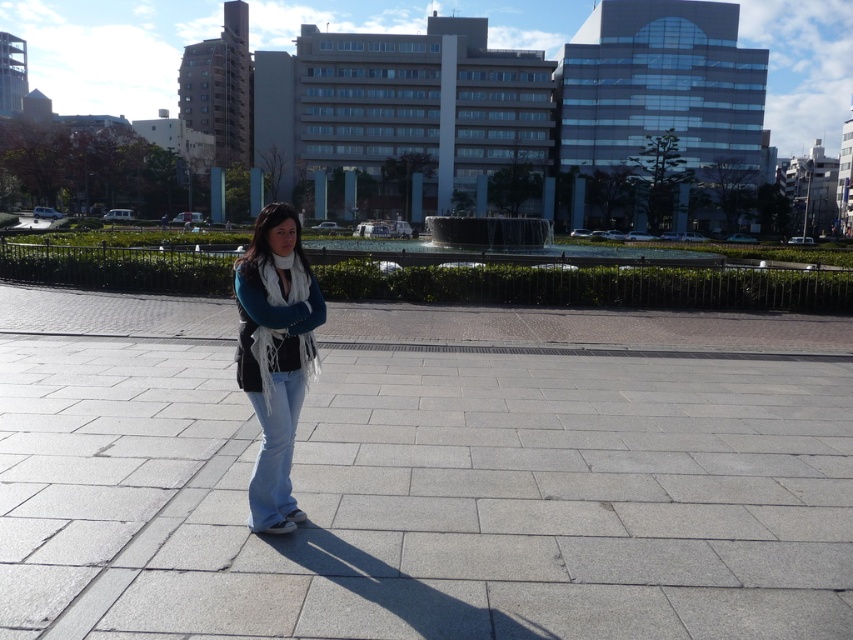
Which is in front, point (575, 508) or point (280, 497)?

Point (280, 497) is more forward.

Does gray concrete pavement at center have a greater width compared to denim jeans at center?

Correct, the width of gray concrete pavement at center exceeds that of denim jeans at center.

Between point (605, 474) and point (236, 285), which one is positioned behind?

Positioned behind is point (605, 474).

Identify the location of gray concrete pavement at center. The width and height of the screenshot is (853, 640). (425, 497).

Is the position of gray concrete pavement at center more distant than that of light blue denim jeans at center?

No, gray concrete pavement at center is in front of light blue denim jeans at center.

From the picture: Can you confirm if gray concrete pavement at center is thinner than light blue denim jeans at center?

No, gray concrete pavement at center is not thinner than light blue denim jeans at center.

The image size is (853, 640). What do you see at coordinates (425, 497) in the screenshot?
I see `gray concrete pavement at center` at bounding box center [425, 497].

I want to click on gray concrete pavement at center, so click(x=425, y=497).

Who is shorter, denim jeans at center or light blue denim jeans at center?

light blue denim jeans at center is shorter.

Describe the element at coordinates (276, 355) in the screenshot. Image resolution: width=853 pixels, height=640 pixels. I see `denim jeans at center` at that location.

Between point (259, 232) and point (262, 516), which one is positioned behind?

The point (262, 516) is behind.

I want to click on denim jeans at center, so click(x=276, y=355).